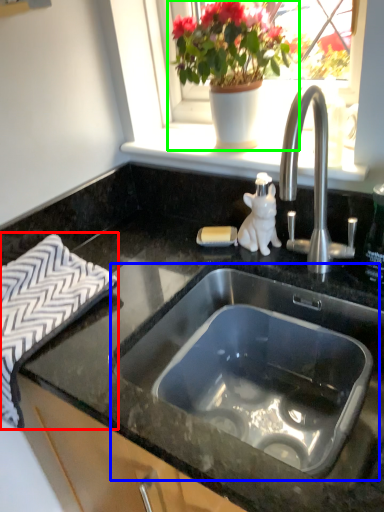
Question: Considering the real-world distances, which object is closest to bath towel (highlighted by a red box)? sink (highlighted by a blue box) or houseplant (highlighted by a green box).

Choices:
 (A) sink
 (B) houseplant

Answer: (A)